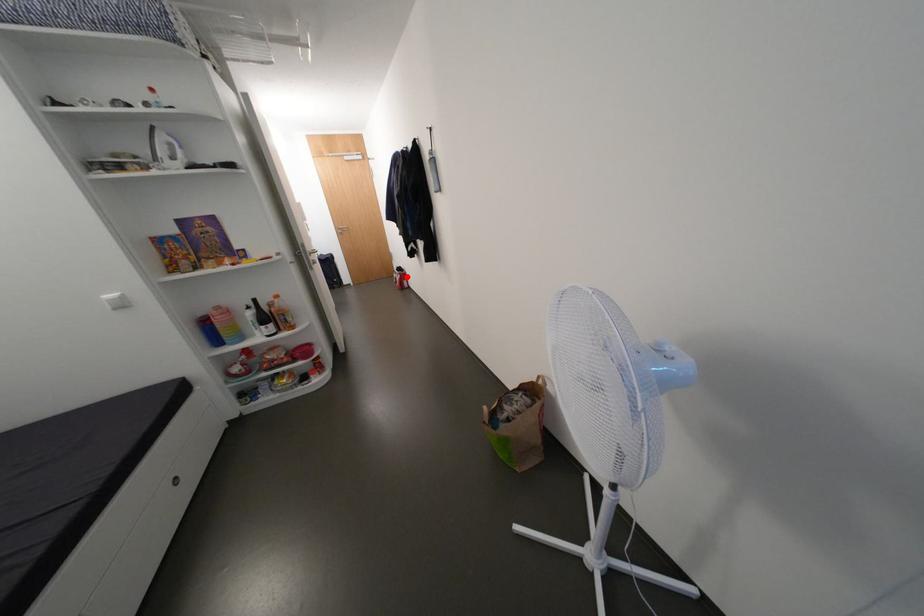
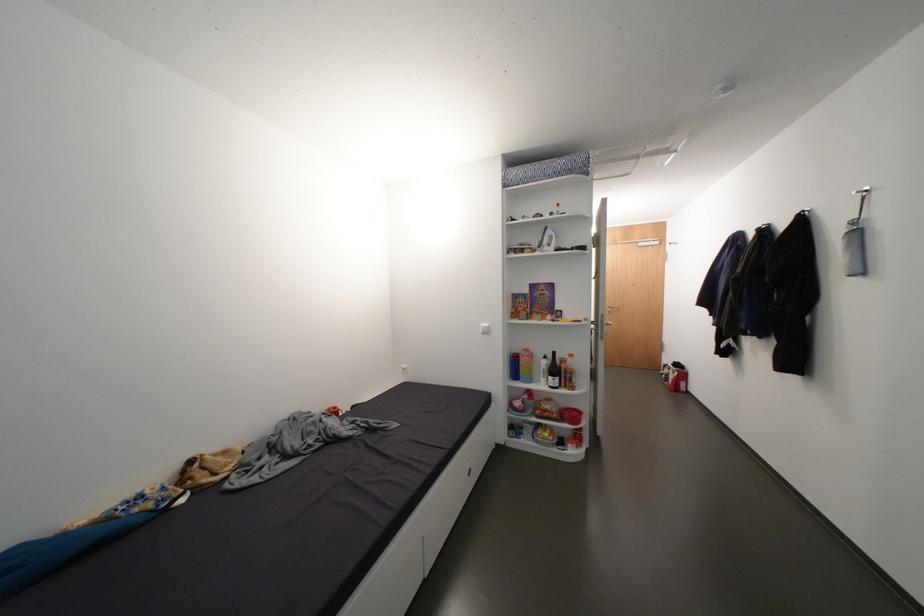
Find the pixel in the second image that matches the highlighted location in the first image.

(684, 374)